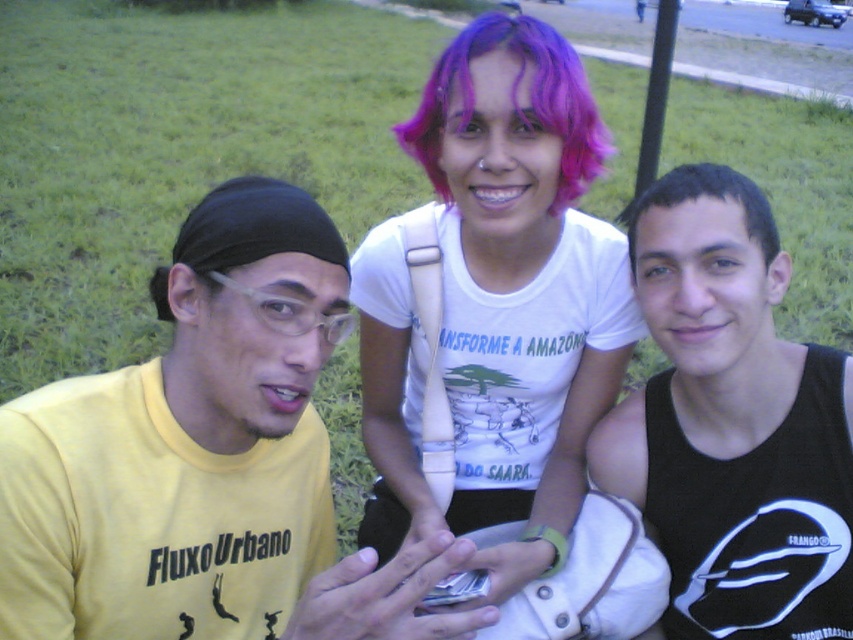
Question: Is green grass at center smaller than dark brown hair at right?

Choices:
 (A) no
 (B) yes

Answer: (A)

Question: Which object is closer to the camera taking this photo?

Choices:
 (A) yellow matte t-shirt at left
 (B) green grass at center

Answer: (A)

Question: Which point is farther to the camera?

Choices:
 (A) (722, 179)
 (B) (352, 84)
 (C) (727, 540)

Answer: (B)

Question: Which point is farther from the camera taking this photo?

Choices:
 (A) (759, 225)
 (B) (10, 122)

Answer: (B)

Question: In this image, where is black tank top at right located relative to dark brown hair at right?

Choices:
 (A) above
 (B) below

Answer: (B)

Question: Is green grass at center positioned behind yellow matte t-shirt at left?

Choices:
 (A) no
 (B) yes

Answer: (B)